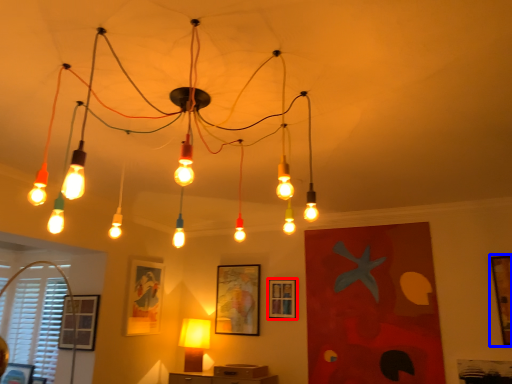
Question: Among these objects, which one is farthest to the camera, picture frame (highlighted by a red box) or picture frame (highlighted by a blue box)?

Choices:
 (A) picture frame
 (B) picture frame

Answer: (A)